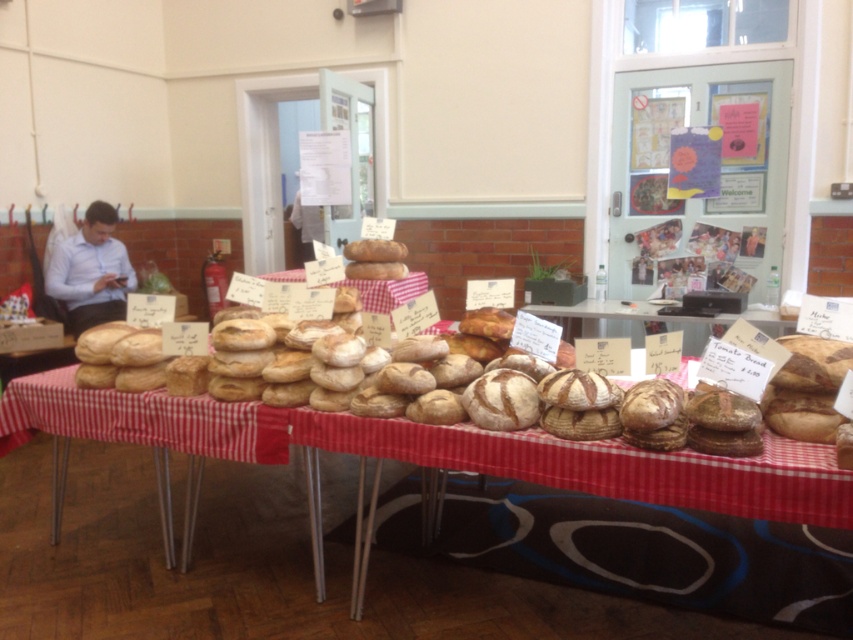
You are a customer at the bread display. You see the matte brown bread at center and the matte blue shirt at left. Which item is positioned to the right of the other?

The matte brown bread at center is to the right of the matte blue shirt at left.